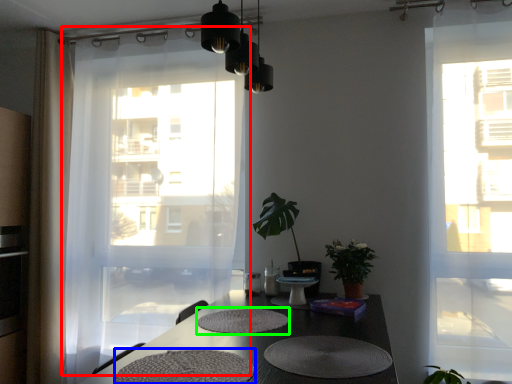
Question: Based on their relative distances, which object is farther from curtain (highlighted by a red box)? Choose from wide (highlighted by a blue box) and mat (highlighted by a green box).

Choices:
 (A) wide
 (B) mat

Answer: (A)